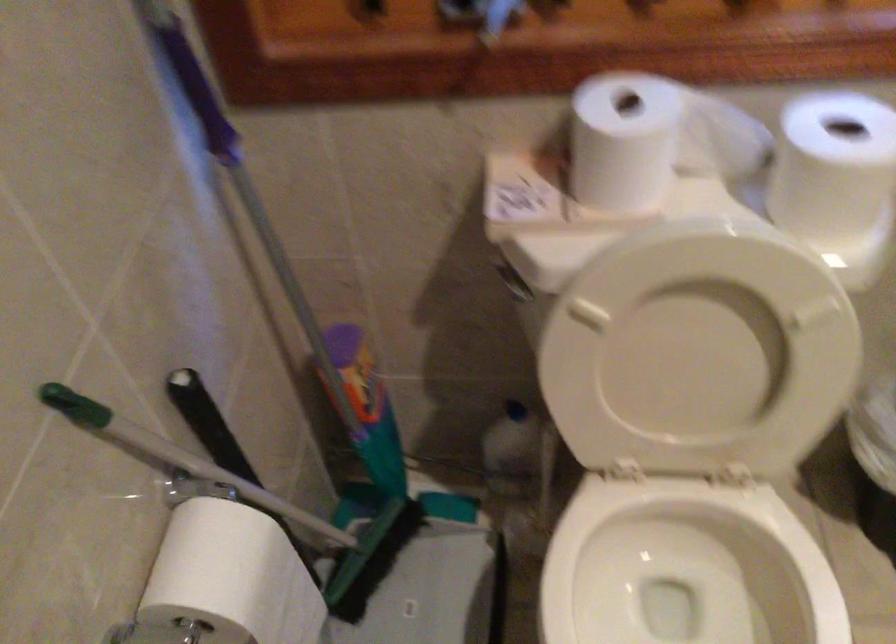
I want to click on purple mop handle, so click(352, 564).